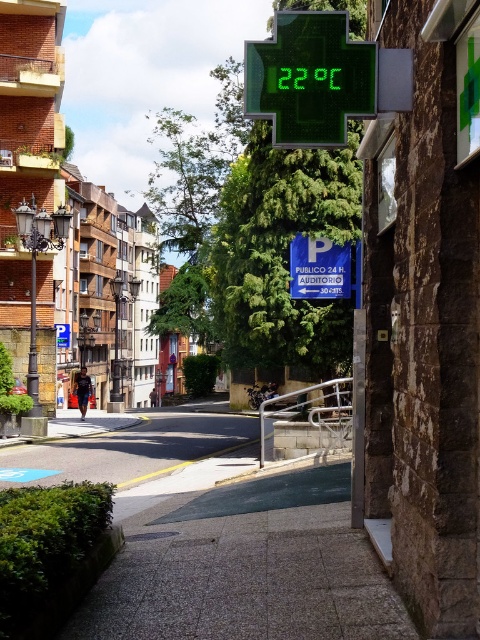
Question: Which object appears closest to the camera in this image?

Choices:
 (A) gray concrete pavement at lower center
 (B) white plastic parking sign at center
 (C) green digital display at upper center

Answer: (A)

Question: Among these objects, which one is nearest to the camera?

Choices:
 (A) gray concrete pavement at lower center
 (B) green digital display at upper center

Answer: (A)

Question: Can you confirm if gray concrete pavement at lower center is wider than white plastic parking sign at center?

Choices:
 (A) yes
 (B) no

Answer: (B)

Question: In this image, where is gray concrete pavement at lower center located relative to green digital display at upper center?

Choices:
 (A) below
 (B) above

Answer: (A)

Question: Can you confirm if gray concrete pavement at lower center is smaller than white plastic parking sign at center?

Choices:
 (A) yes
 (B) no

Answer: (A)

Question: Which is nearer to the gray concrete pavement at lower center?

Choices:
 (A) white plastic parking sign at center
 (B) green digital display at upper center

Answer: (B)